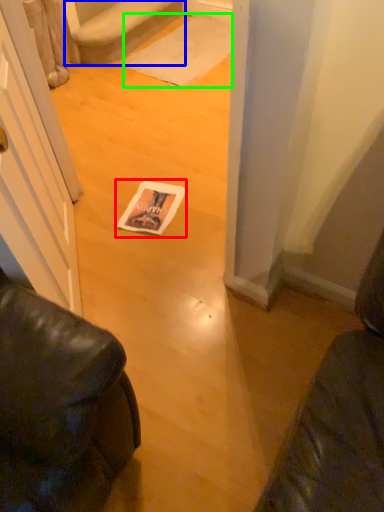
Question: Estimate the real-world distances between objects in this image. Which object is farther from magazine (highlighted by a red box), stairwell (highlighted by a blue box) or doormat (highlighted by a green box)?

Choices:
 (A) stairwell
 (B) doormat

Answer: (A)